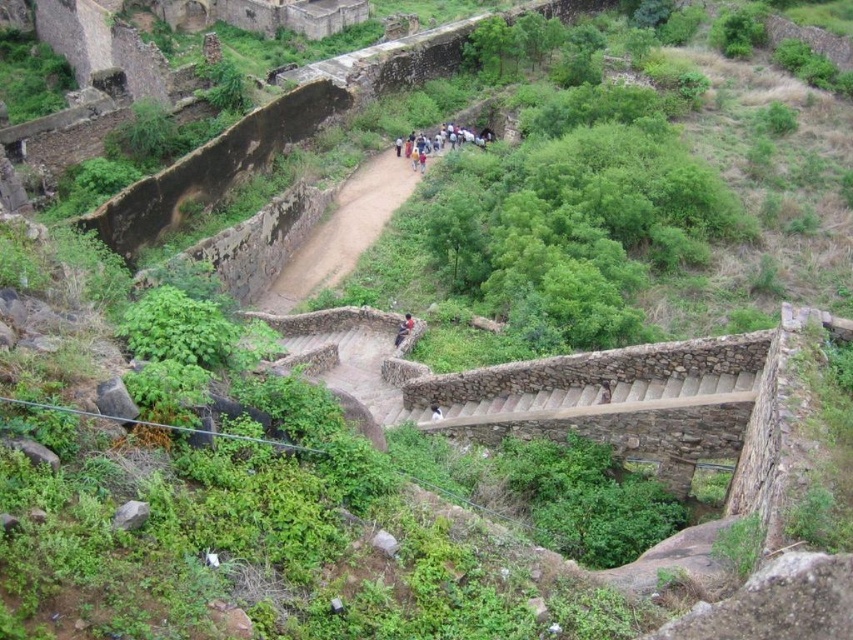
Question: Which object is positioned farthest from the smooth skin person at center?

Choices:
 (A) multicolored clothing group at center
 (B) dark blue fabric at center

Answer: (A)

Question: Is smooth skin person at center below dark blue fabric at center?

Choices:
 (A) yes
 (B) no

Answer: (B)

Question: Which point is closer to the camera?

Choices:
 (A) dark blue fabric at center
 (B) multicolored clothing group at center
 (C) smooth skin person at center

Answer: (A)

Question: Among these points, which one is nearest to the camera?

Choices:
 (A) (432, 403)
 (B) (410, 134)
 (C) (402, 330)

Answer: (A)

Question: Does multicolored clothing group at center come in front of dark blue fabric at center?

Choices:
 (A) no
 (B) yes

Answer: (A)

Question: Is multicolored clothing group at center above dark blue fabric at center?

Choices:
 (A) yes
 (B) no

Answer: (A)